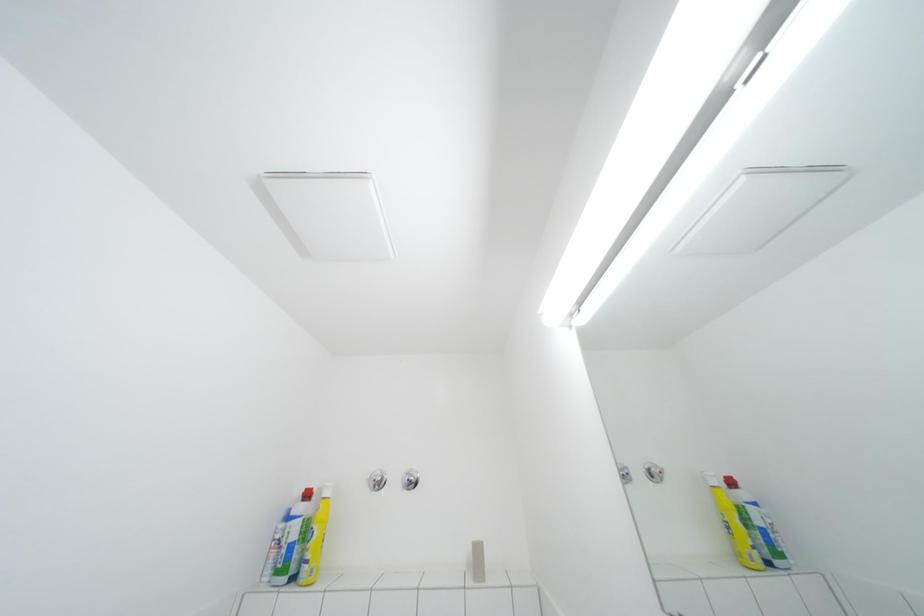
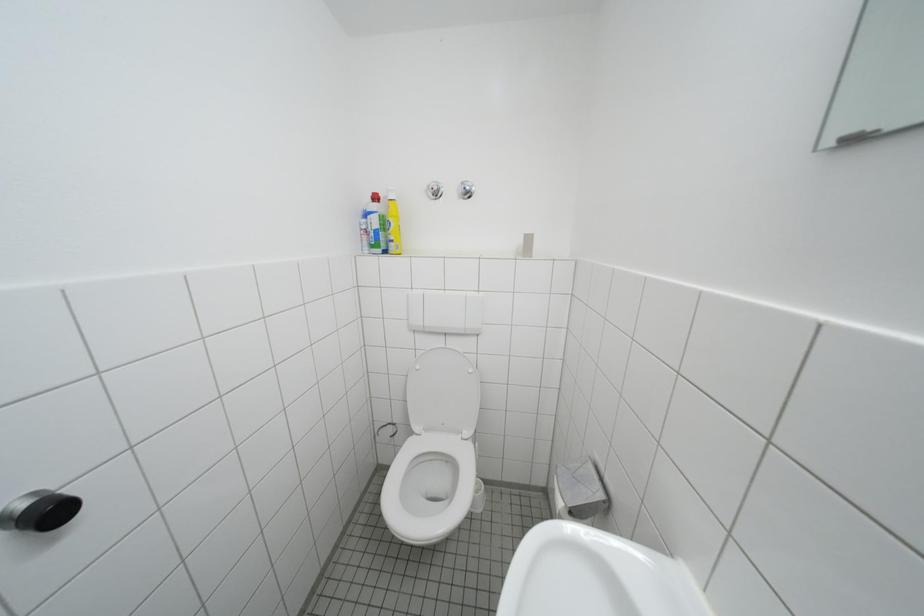
Question: Based on the continuous images, in which direction is the camera rotating? Reply with the corresponding letter.

Choices:
 (A) Left
 (B) Right
 (C) Up
 (D) Down

Answer: (D)